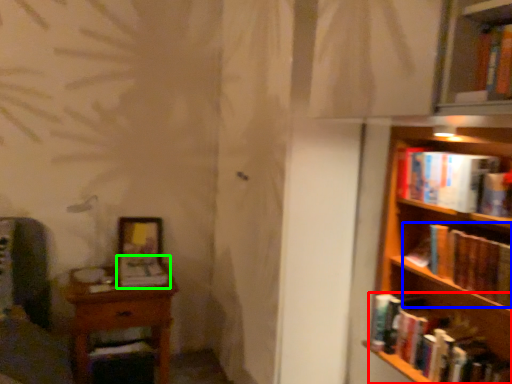
Question: Which object is positioned farthest from book (highlighted by a red box)? Select from book (highlighted by a blue box) and book (highlighted by a green box).

Choices:
 (A) book
 (B) book

Answer: (B)